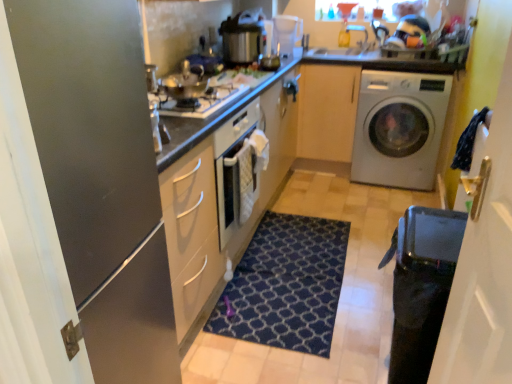
Question: Does transparent glass door at right, the 2th glass door in the left-to-right sequence, have a greater height compared to transparent plastic coffee machine at upper center?

Choices:
 (A) yes
 (B) no

Answer: (A)

Question: Considering the relative sizes of transparent glass door at right, which is counted as the 1th glass door, starting from the right, and transparent plastic coffee machine at upper center in the image provided, is transparent glass door at right, which is counted as the 1th glass door, starting from the right, bigger than transparent plastic coffee machine at upper center?

Choices:
 (A) yes
 (B) no

Answer: (A)

Question: Can you confirm if transparent glass door at right, the 2th glass door in the left-to-right sequence, is positioned to the left of transparent plastic coffee machine at upper center?

Choices:
 (A) no
 (B) yes

Answer: (A)

Question: Is transparent glass door at right, the 2th glass door in the left-to-right sequence, to the right of transparent plastic coffee machine at upper center from the viewer's perspective?

Choices:
 (A) yes
 (B) no

Answer: (A)

Question: Does transparent glass door at right, which is counted as the 1th glass door, starting from the right, have a lesser height compared to transparent plastic coffee machine at upper center?

Choices:
 (A) yes
 (B) no

Answer: (B)

Question: From a real-world perspective, is metallic pressure cooker at upper center physically located above or below matte black refrigerator at left, arranged as the first glass door when viewed from the left?

Choices:
 (A) above
 (B) below

Answer: (A)

Question: Considering their positions, is metallic pressure cooker at upper center located in front of or behind matte black refrigerator at left, arranged as the first glass door when viewed from the left?

Choices:
 (A) behind
 (B) front

Answer: (A)

Question: In terms of width, does metallic pressure cooker at upper center look wider or thinner when compared to matte black refrigerator at left, arranged as the first glass door when viewed from the left?

Choices:
 (A) thin
 (B) wide

Answer: (A)

Question: From the image's perspective, is metallic pressure cooker at upper center above or below matte black refrigerator at left, arranged as the first glass door when viewed from the left?

Choices:
 (A) below
 (B) above

Answer: (B)

Question: Considering the positions of point (347, 61) and point (239, 92), is point (347, 61) closer or farther from the camera than point (239, 92)?

Choices:
 (A) farther
 (B) closer

Answer: (A)

Question: From the image's perspective, is white glossy countertop at upper center located above or below satin silver gas stove at center?

Choices:
 (A) above
 (B) below

Answer: (A)

Question: Is white glossy countertop at upper center inside the boundaries of satin silver gas stove at center, or outside?

Choices:
 (A) inside
 (B) outside

Answer: (B)

Question: Considering the positions of white glossy countertop at upper center and satin silver gas stove at center in the image, is white glossy countertop at upper center taller or shorter than satin silver gas stove at center?

Choices:
 (A) short
 (B) tall

Answer: (B)

Question: In the image, is transparent plastic coffee machine at upper center positioned in front of or behind transparent glass door at right, which is counted as the 1th glass door, starting from the right?

Choices:
 (A) front
 (B) behind

Answer: (B)

Question: From their relative heights in the image, would you say transparent plastic coffee machine at upper center is taller or shorter than transparent glass door at right, which is counted as the 1th glass door, starting from the right?

Choices:
 (A) short
 (B) tall

Answer: (A)